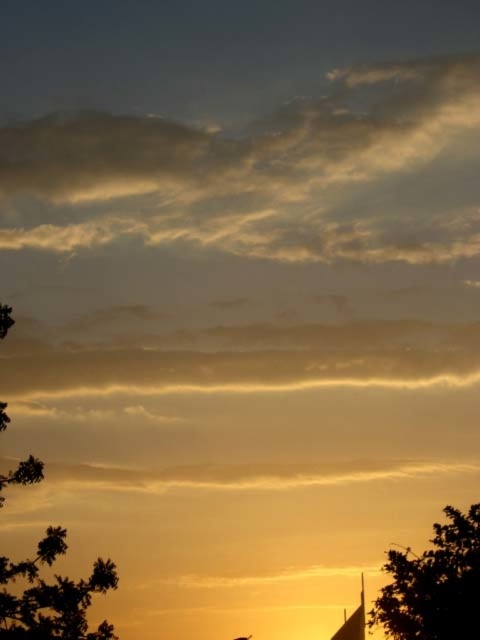
Who is lower down, green leafy tree at lower right or dark green leafy tree at left?

green leafy tree at lower right is below.

Is green leafy tree at lower right further to camera compared to dark green leafy tree at left?

Yes, it is.

Is point (419, 586) farther from camera compared to point (72, 586)?

Yes.

Image resolution: width=480 pixels, height=640 pixels. I want to click on green leafy tree at lower right, so click(433, 582).